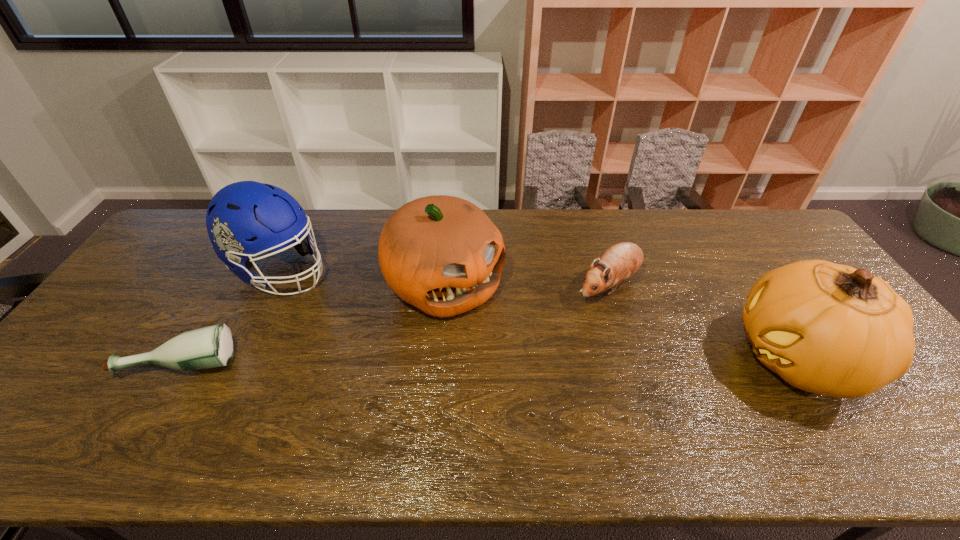
I want to click on free spot located 0.070m on the face of the third object from right to left, so click(499, 333).

Identify the location of vacant position located on the face of the third object from right to left. This screenshot has height=540, width=960. (509, 342).

At what (x,y) coordinates should I click in order to perform the action: click on free space located 0.130m on the face of the third object from right to left. Please return your answer as a coordinate pair (x, y). Looking at the image, I should click on (514, 347).

Where is `vacant space positioned at the face of the second shortest object`? This screenshot has height=540, width=960. vacant space positioned at the face of the second shortest object is located at coordinates (564, 311).

Locate an element on the screen. This screenshot has height=540, width=960. free point located 0.210m at the face of the second shortest object is located at coordinates (527, 331).

Locate an element on the screen. Image resolution: width=960 pixels, height=540 pixels. free location located at the face of the second shortest object is located at coordinates (492, 351).

You are a GUI agent. You are given a task and a screenshot of the screen. Output one action in this format:
    pyautogui.click(x=<x>, y=<y>)
    Task: Click on the vacant area located on the face guard of the football helmet
    The height and width of the screenshot is (540, 960).
    Given the screenshot: What is the action you would take?
    pyautogui.click(x=396, y=324)

This screenshot has width=960, height=540. What are the coordinates of `free spot located on the face guard of the football helmet` in the screenshot? It's located at (369, 310).

The image size is (960, 540). I want to click on vacant space situated on the face guard of the football helmet, so click(x=402, y=327).

Locate an element on the screen. pumpkin present at the far edge is located at coordinates (442, 254).